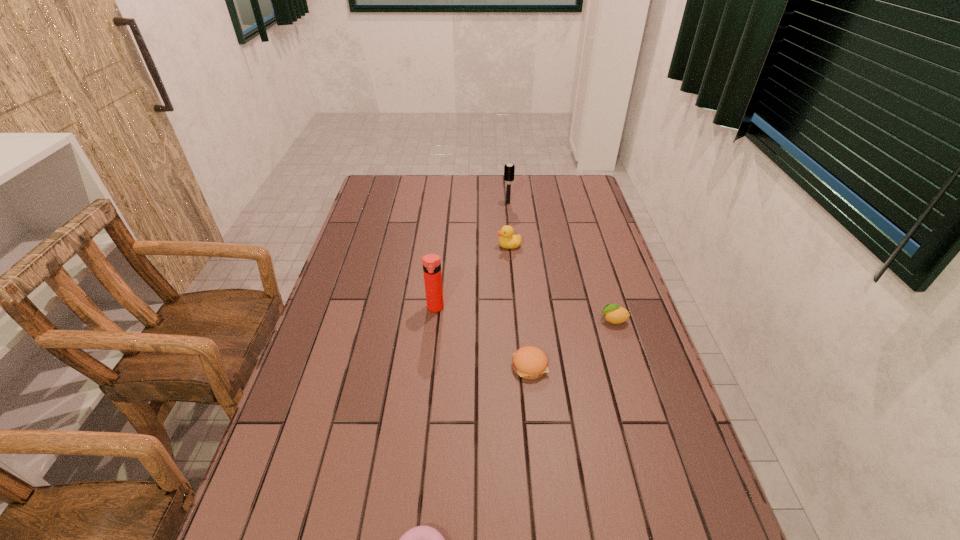
Locate which object is the second closest to the hairbrush. Please provide its 2D coordinates. Your answer should be formatted as a tuple, i.e. [(x, y)], where the tuple contains the x and y coordinates of a point satisfying the conditions above.

[(431, 263)]

Where is `object that is the fifth closest one to the fourth shortest object`? object that is the fifth closest one to the fourth shortest object is located at coordinates (423, 539).

The height and width of the screenshot is (540, 960). What are the coordinates of `free space that satisfies the following two spatial constraints: 1. on the face of the second farthest object; 2. on the right side of the second nearest object` in the screenshot? It's located at (519, 366).

Where is `vacant space that satisfies the following two spatial constraints: 1. on the front side of the second nearest object; 2. on the right side of the thermos bottle`? This screenshot has width=960, height=540. vacant space that satisfies the following two spatial constraints: 1. on the front side of the second nearest object; 2. on the right side of the thermos bottle is located at coordinates (429, 366).

You are a GUI agent. You are given a task and a screenshot of the screen. Output one action in this format:
    pyautogui.click(x=<x>, y=<y>)
    Task: Click on the vacant position in the image that satisfies the following two spatial constraints: 1. on the face of the fourth shortest object; 2. on the back side of the fifth farthest object
    Image resolution: width=960 pixels, height=540 pixels.
    Given the screenshot: What is the action you would take?
    pyautogui.click(x=519, y=366)

Where is `vacant area that satisfies the following two spatial constraints: 1. on the face of the fifth nearest object; 2. on the front side of the thermos bottle`? vacant area that satisfies the following two spatial constraints: 1. on the face of the fifth nearest object; 2. on the front side of the thermos bottle is located at coordinates (515, 308).